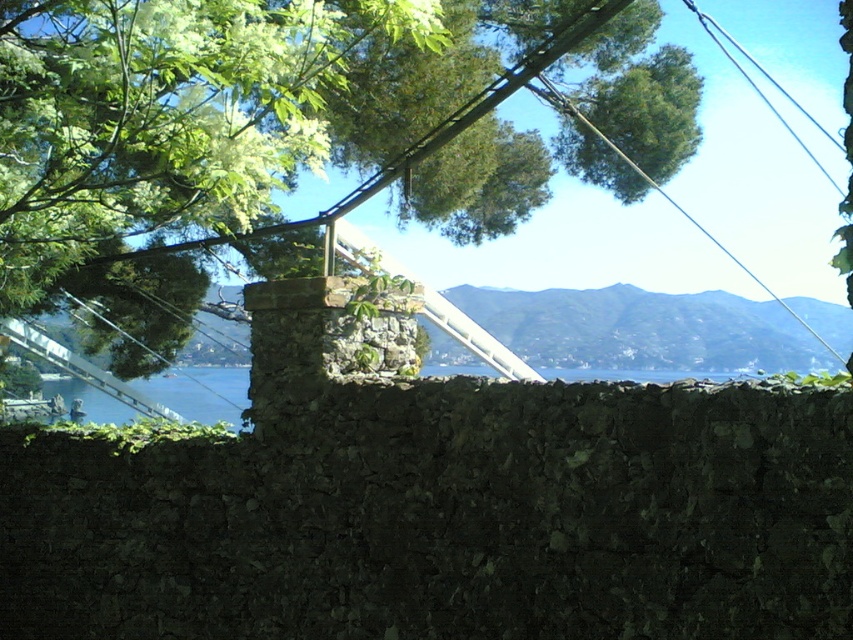
In the scene shown: You are an artist sketching the scene from behind the stone wall. You notice the green leafy tree at upper left and the black wire at upper right. Which object appears narrower in your drawing?

The green leafy tree at upper left appears narrower than the black wire at upper right in the scene.

You are standing behind the stone wall and want to take a photo of the green leafy tree at upper left and the black wire at upper right. Which object should you focus on first to ensure both are in clear view?

You should focus on the green leafy tree at upper left first because it is closer to you than the black wire at upper right, so adjusting focus from near to far will help both be in clear view.